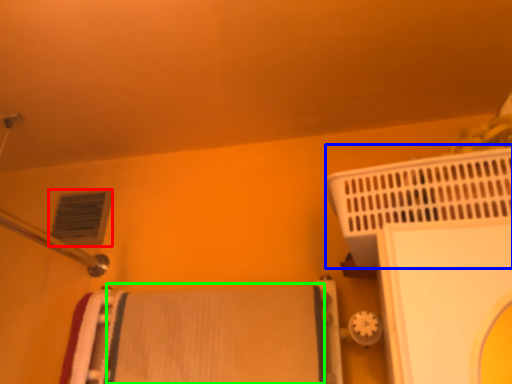
Question: Which object is the closest to the air conditioning (highlighted by a red box)? Choose among these: bath heater (highlighted by a blue box) or bath towel (highlighted by a green box).

Choices:
 (A) bath heater
 (B) bath towel

Answer: (B)